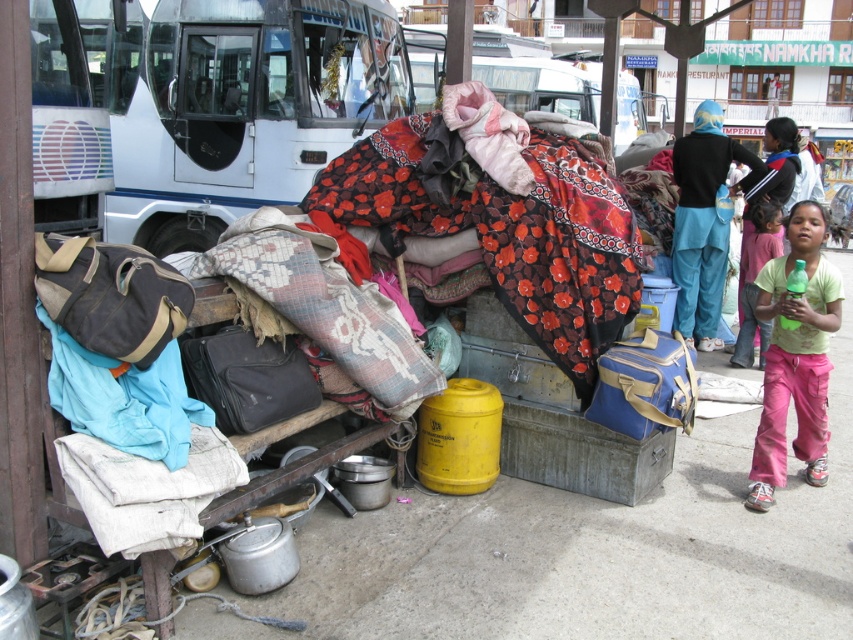
You are a traveler standing at the bus station and see the green cotton shirt at lower right and the blue fabric pants at right. Which clothing item is closer to you?

The green cotton shirt at lower right is closer to you because it is in front of the blue fabric pants at right.